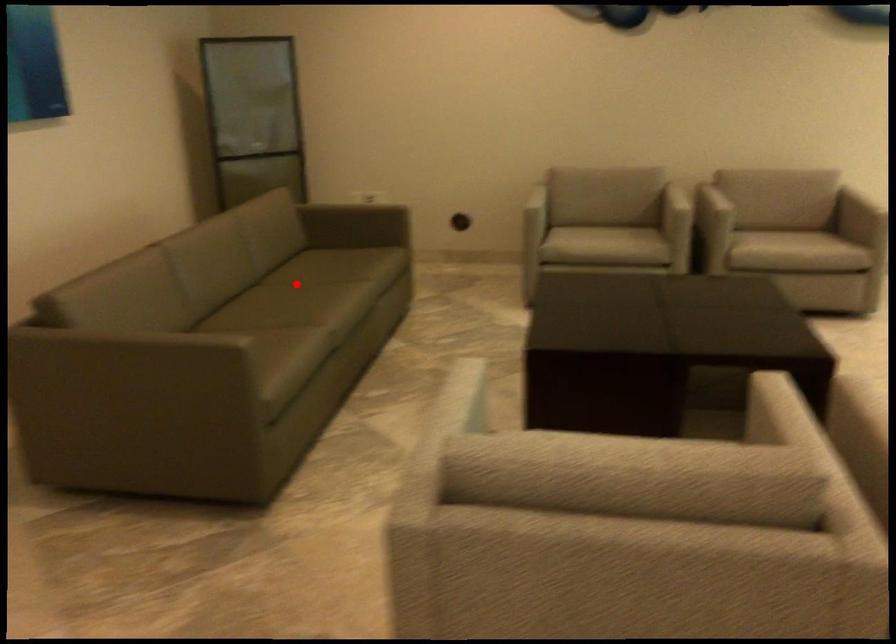
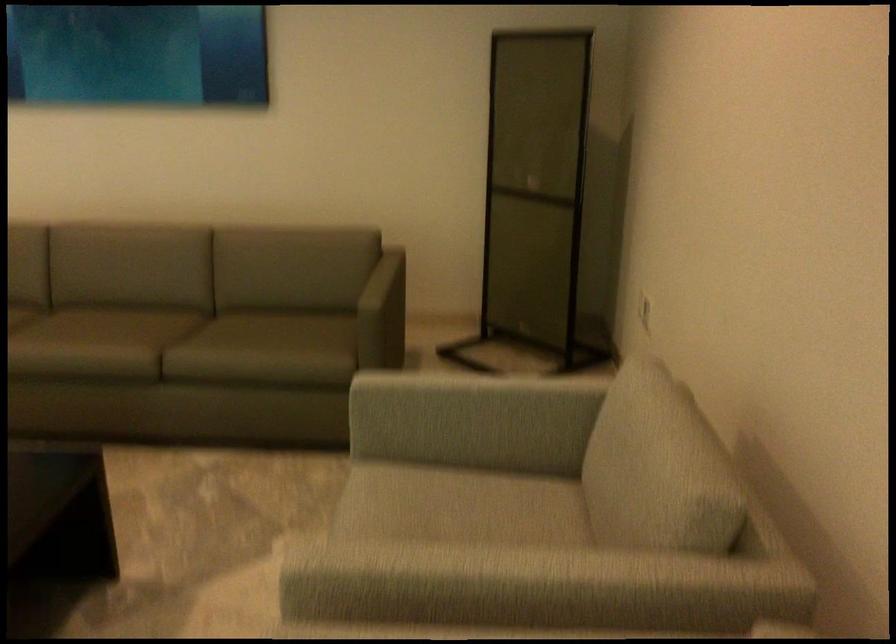
Question: I am providing you with two images of the same scene from different viewpoints. A red point is shown in image1. For the corresponding object point in image2, is it positioned nearer or farther from the camera?

Choices:
 (A) Nearer
 (B) Farther

Answer: (A)